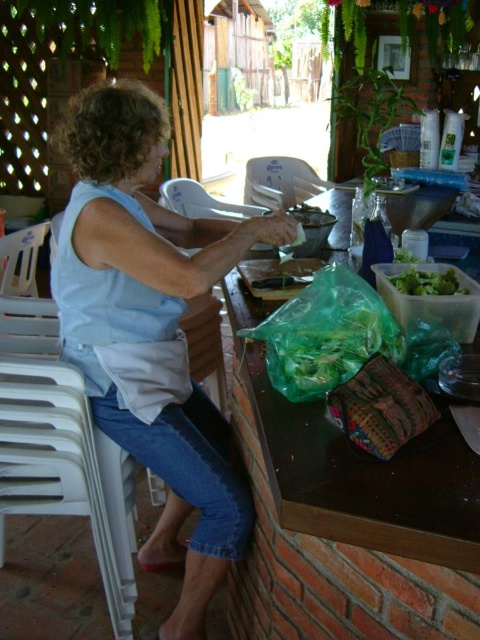
Question: Considering the real-world distances, which object is farthest from the light blue fabric at center?

Choices:
 (A) green leafy salad at center
 (B) transparent plastic bag at center

Answer: (A)

Question: Can you confirm if transparent plastic bag at center is positioned below green leafy salad at center?

Choices:
 (A) yes
 (B) no

Answer: (A)

Question: Which object appears closest to the camera in this image?

Choices:
 (A) green leafy salad at center
 (B) transparent plastic bag at center

Answer: (B)

Question: Is light blue fabric at center further to the viewer compared to green leafy salad at center?

Choices:
 (A) no
 (B) yes

Answer: (A)

Question: Which of the following is the farthest from the observer?

Choices:
 (A) transparent plastic bag at center
 (B) green leafy salad at center

Answer: (B)

Question: From the image, what is the correct spatial relationship of transparent plastic bag at center in relation to green leafy salad at center?

Choices:
 (A) left
 (B) right

Answer: (A)